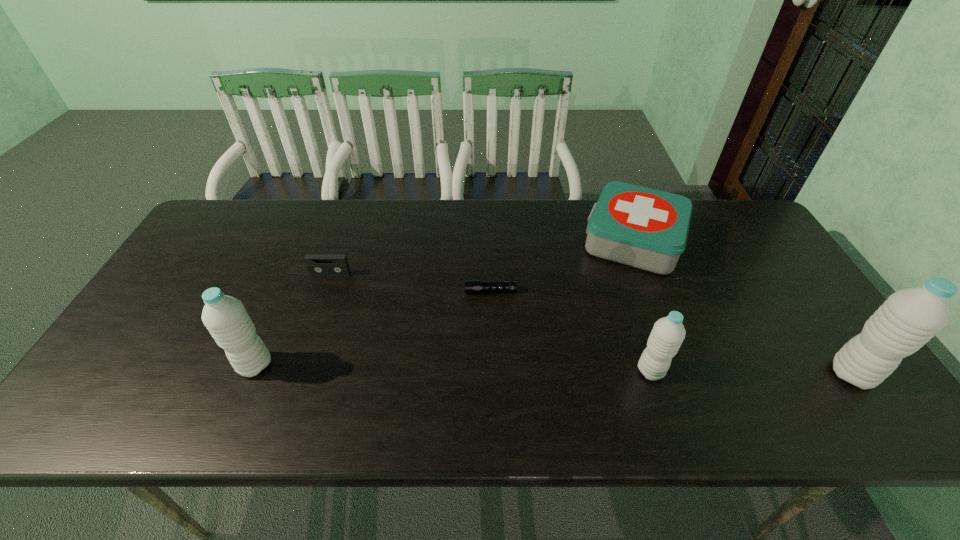
Identify the location of vacant area that lies between the third farthest object and the second tallest object. Image resolution: width=960 pixels, height=540 pixels. (372, 328).

Locate an element on the screen. The height and width of the screenshot is (540, 960). free spot between the second water bottle from right to left and the second tallest water bottle is located at coordinates pyautogui.click(x=453, y=368).

Locate an element on the screen. The width and height of the screenshot is (960, 540). free space between the second tallest water bottle and the shortest water bottle is located at coordinates (453, 368).

You are a GUI agent. You are given a task and a screenshot of the screen. Output one action in this format:
    pyautogui.click(x=<x>, y=<y>)
    Task: Click on the free space that is in between the shortest water bottle and the first-aid kit
    The width and height of the screenshot is (960, 540).
    Given the screenshot: What is the action you would take?
    pyautogui.click(x=642, y=306)

The height and width of the screenshot is (540, 960). I want to click on blank region between the videotape and the fourth shortest object, so 491,322.

You are a GUI agent. You are given a task and a screenshot of the screen. Output one action in this format:
    pyautogui.click(x=<x>, y=<y>)
    Task: Click on the free area in between the third tallest object and the fifth tallest object
    This screenshot has width=960, height=540.
    Given the screenshot: What is the action you would take?
    pyautogui.click(x=491, y=322)

Where is `free space between the second tallest object and the rightmost object`? The height and width of the screenshot is (540, 960). free space between the second tallest object and the rightmost object is located at coordinates (553, 369).

Where is `empty location between the leftmost object and the fourth shortest object`? empty location between the leftmost object and the fourth shortest object is located at coordinates (453, 368).

Identify which object is the fourth closest to the shortest object. Please provide its 2D coordinates. Your answer should be formatted as a tuple, i.e. [(x, y)], where the tuple contains the x and y coordinates of a point satisfying the conditions above.

[(225, 317)]

Where is `the fifth closest object to the tallest object`? the fifth closest object to the tallest object is located at coordinates (225, 317).